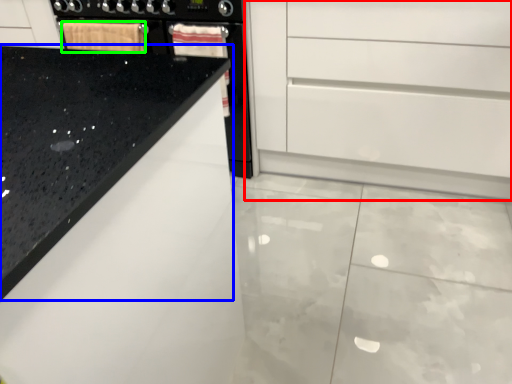
Question: Considering the real-world distances, which object is closest to chest of drawers (highlighted by a red box)? countertop (highlighted by a blue box) or material (highlighted by a green box).

Choices:
 (A) countertop
 (B) material

Answer: (B)